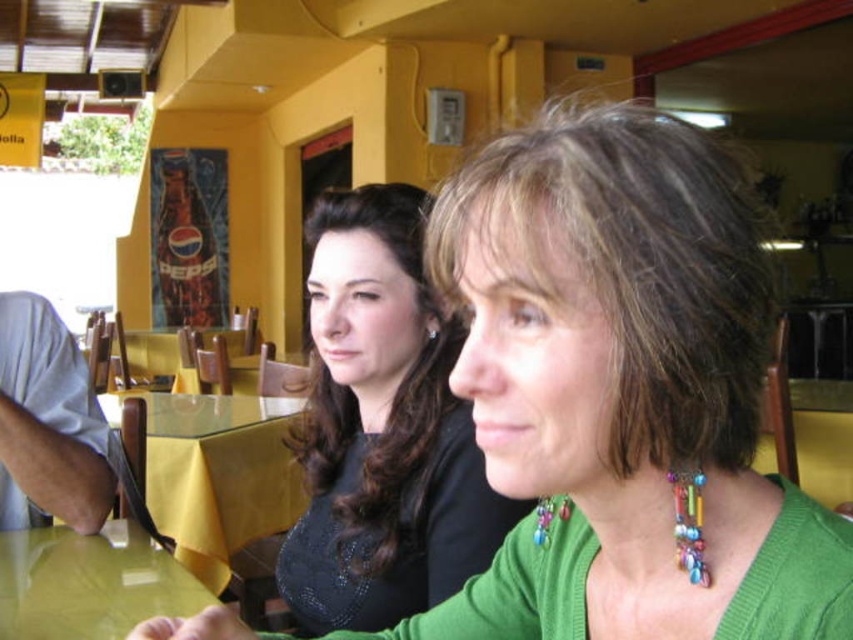
Question: Does black glossy hair at center appear on the right side of glossy yellow table at lower left?

Choices:
 (A) no
 (B) yes

Answer: (B)

Question: From the image, what is the correct spatial relationship of green matte sweater at center in relation to glossy yellow table at lower left?

Choices:
 (A) right
 (B) left

Answer: (A)

Question: Among these objects, which one is farthest from the camera?

Choices:
 (A) green matte sweater at center
 (B) glossy yellow table at lower left
 (C) black glossy hair at center
 (D) multicolored beads necklace at center

Answer: (B)

Question: Which point is farther to the camera?

Choices:
 (A) yellow fabric table at center
 (B) green matte sweater at center

Answer: (A)

Question: Does green matte sweater at center have a smaller size compared to glossy yellow table at lower left?

Choices:
 (A) yes
 (B) no

Answer: (B)

Question: Estimate the real-world distances between objects in this image. Which object is farther from the yellow fabric table at center?

Choices:
 (A) green matte sweater at center
 (B) black glossy hair at center
 (C) glossy yellow table at lower left
 (D) multicolored beads necklace at center

Answer: (D)